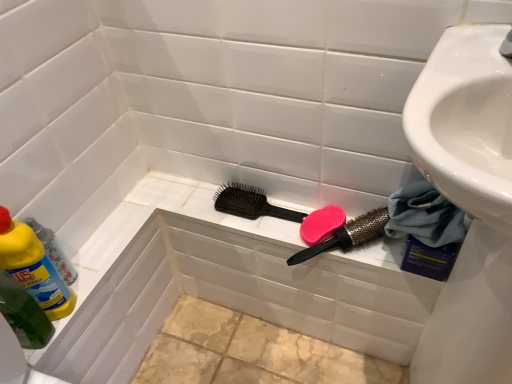
Identify the location of vacant space behind green plastic bottle at left. (106, 235).